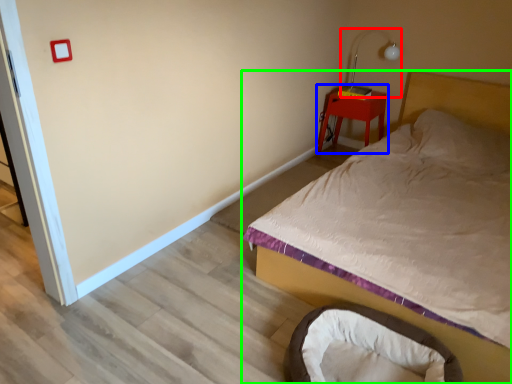
Question: Considering the real-world distances, which object is farthest from table lamp (highlighted by a red box)? nightstand (highlighted by a blue box) or bed (highlighted by a green box)?

Choices:
 (A) nightstand
 (B) bed

Answer: (B)